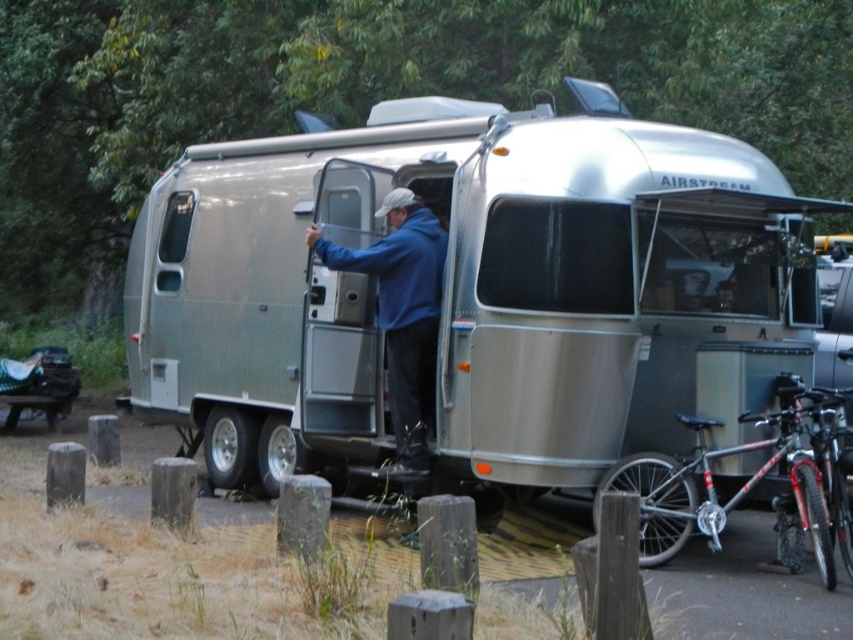
Question: Does silver metallic trailer at center have a smaller size compared to blue matte jacket at center?

Choices:
 (A) yes
 (B) no

Answer: (A)

Question: Which of the following is the farthest from the observer?

Choices:
 (A) blue matte jacket at center
 (B) silver metallic trailer at center

Answer: (B)

Question: Is silver metallic trailer at center smaller than blue matte jacket at center?

Choices:
 (A) no
 (B) yes

Answer: (B)

Question: Is silver metallic trailer at center positioned before blue matte jacket at center?

Choices:
 (A) no
 (B) yes

Answer: (A)

Question: Among these points, which one is farthest from the camera?

Choices:
 (A) (664, 225)
 (B) (317, 225)

Answer: (B)